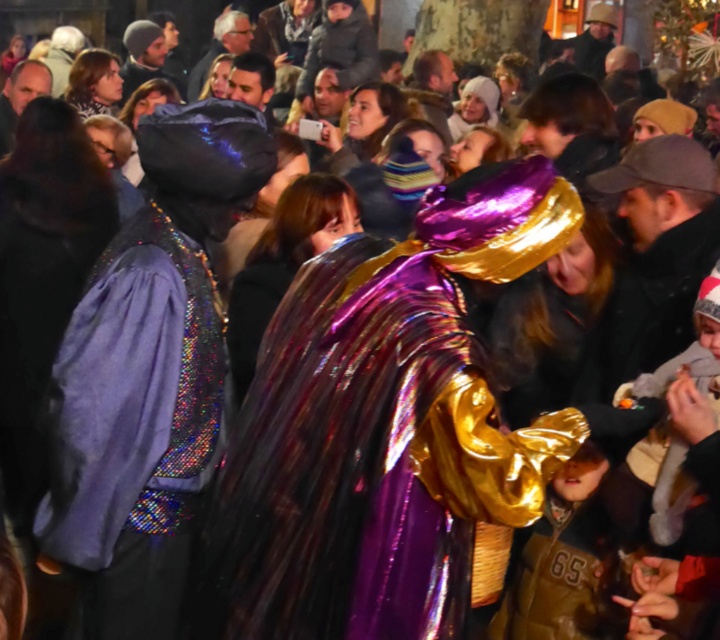
Question: Which object appears farthest from the camera in this image?

Choices:
 (A) metallic purple cape at center
 (B) shiny purple cape at center

Answer: (B)

Question: Which point is farther to the camera?

Choices:
 (A) shiny purple cape at center
 (B) metallic purple cape at center

Answer: (A)

Question: Is metallic purple cape at center further to camera compared to shiny purple cape at center?

Choices:
 (A) no
 (B) yes

Answer: (A)

Question: In this image, where is metallic purple cape at center located relative to shiny purple cape at center?

Choices:
 (A) right
 (B) left

Answer: (A)

Question: Which point is farther to the camera?

Choices:
 (A) (198, 467)
 (B) (220, 490)

Answer: (A)

Question: Is metallic purple cape at center above shiny purple cape at center?

Choices:
 (A) no
 (B) yes

Answer: (A)